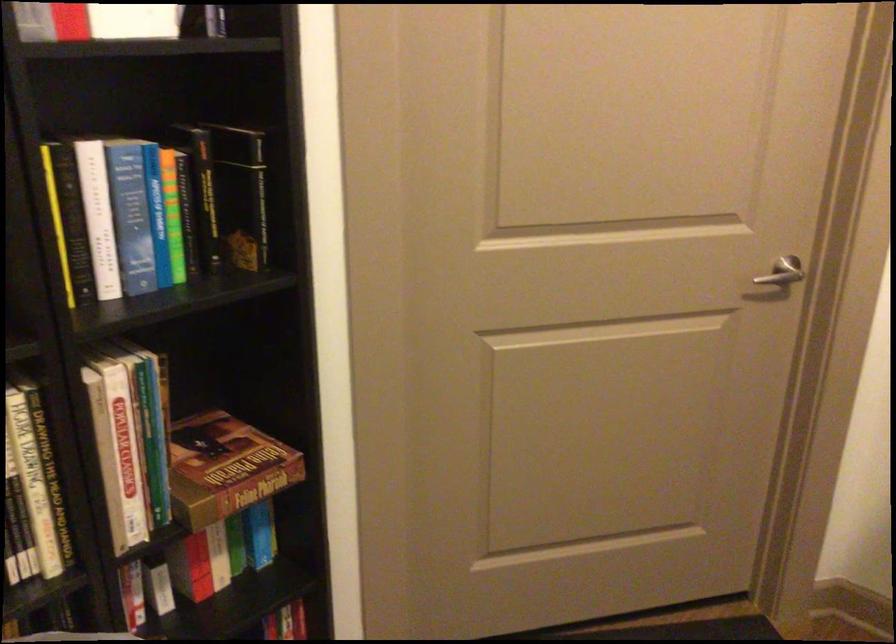
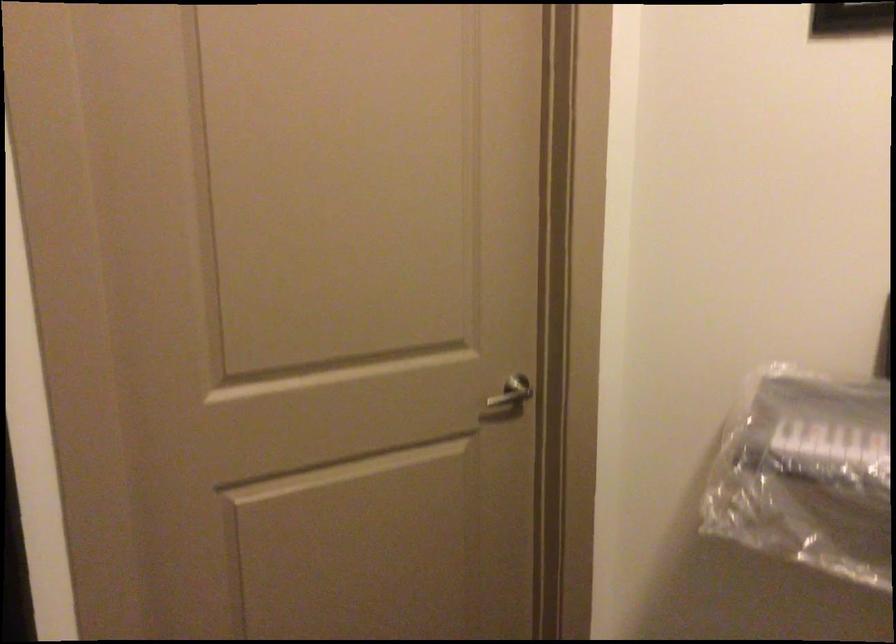
Where in the second image is the point corresponding to point 782,269 from the first image?

(512, 392)